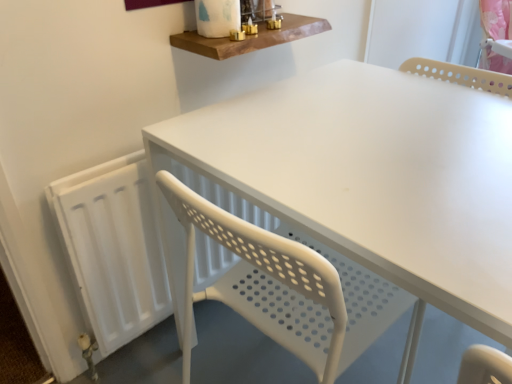
Question: Should I look upward or downward to see white matte table at center?

Choices:
 (A) up
 (B) down

Answer: (B)

Question: Is white matte radiator at left not close to white matte table at center?

Choices:
 (A) yes
 (B) no

Answer: (B)

Question: Is white matte radiator at left thinner than white matte table at center?

Choices:
 (A) no
 (B) yes

Answer: (B)

Question: Can you confirm if white matte radiator at left is smaller than white matte table at center?

Choices:
 (A) no
 (B) yes

Answer: (B)

Question: Is white matte radiator at left completely or partially outside of white matte table at center?

Choices:
 (A) yes
 (B) no

Answer: (A)

Question: Could you tell me if white matte radiator at left is turned towards white matte table at center?

Choices:
 (A) yes
 (B) no

Answer: (A)

Question: From a real-world perspective, is white matte radiator at left physically above white matte table at center?

Choices:
 (A) no
 (B) yes

Answer: (A)

Question: Is white matte table at center smaller than white matte radiator at left?

Choices:
 (A) no
 (B) yes

Answer: (A)

Question: Can we say white matte table at center lies outside white matte radiator at left?

Choices:
 (A) yes
 (B) no

Answer: (A)

Question: Is white matte table at center next to white matte radiator at left and touching it?

Choices:
 (A) yes
 (B) no

Answer: (B)

Question: From a real-world perspective, is white matte table at center positioned under white matte radiator at left based on gravity?

Choices:
 (A) no
 (B) yes

Answer: (A)

Question: From the image's perspective, would you say white matte table at center is positioned over white matte radiator at left?

Choices:
 (A) no
 (B) yes

Answer: (A)

Question: Can you confirm if white matte table at center is bigger than white matte radiator at left?

Choices:
 (A) yes
 (B) no

Answer: (A)

Question: Does wooden shelf at upper center come behind white matte radiator at left?

Choices:
 (A) no
 (B) yes

Answer: (B)